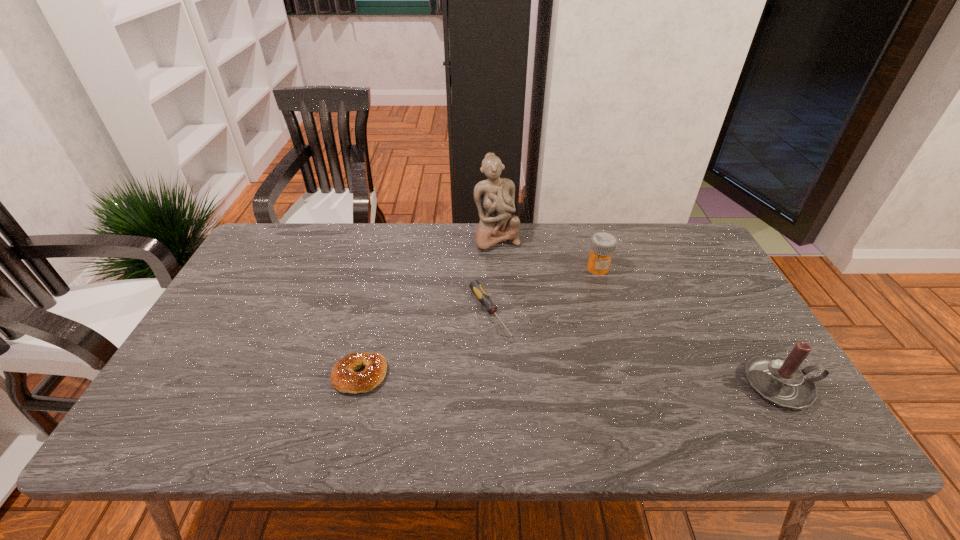
Image resolution: width=960 pixels, height=540 pixels. Identify the location of empty location between the medicine and the third nearest object. (543, 290).

The height and width of the screenshot is (540, 960). What are the coordinates of `unoccupied area between the fourth nearest object and the tallest object` in the screenshot? It's located at (547, 253).

Locate an element on the screen. Image resolution: width=960 pixels, height=540 pixels. vacant area that lies between the fourth nearest object and the shortest object is located at coordinates (543, 290).

Find the location of `object that stands as the third closest to the screwdriver`. object that stands as the third closest to the screwdriver is located at coordinates (603, 244).

I want to click on object that ranks as the closest to the second farthest object, so click(494, 197).

This screenshot has width=960, height=540. Identify the location of free space in the image that satisfies the following two spatial constraints: 1. on the front side of the screwdriver; 2. on the side of the fourth shortest object with the handle loop. (491, 385).

The image size is (960, 540). Identify the location of free point that satisfies the following two spatial constraints: 1. on the front side of the leftmost object; 2. on the side of the second tallest object with the handle loop. (358, 385).